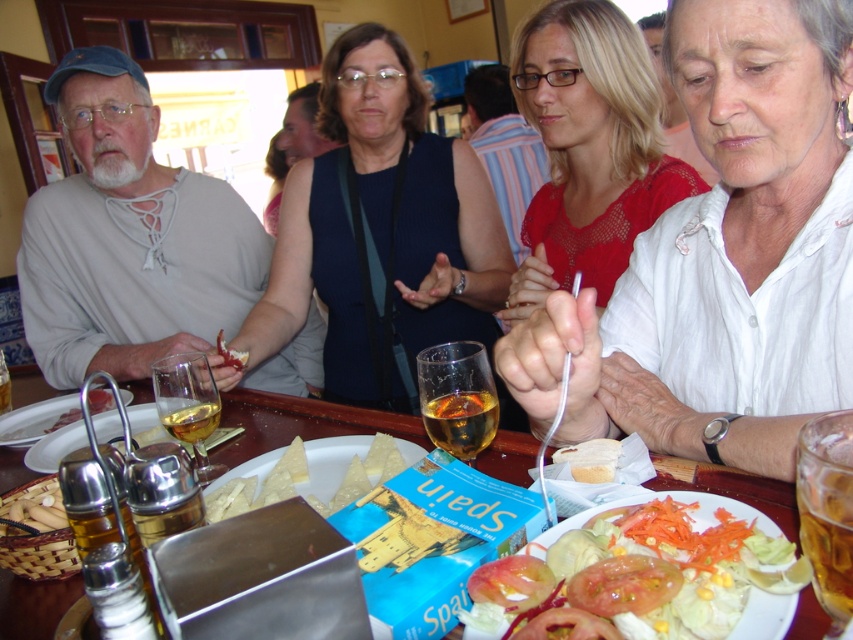
Question: Is yellow crumbly cheese at center bigger than smooth wooden sticks at lower left?

Choices:
 (A) yes
 (B) no

Answer: (A)

Question: Which point appears closest to the camera in this image?

Choices:
 (A) (189, 422)
 (B) (544, 547)
 (C) (840, 413)

Answer: (C)

Question: Which object is the farthest from the yellow crumbly cheese at center?

Choices:
 (A) white cotton shirt at upper right
 (B) smooth glass bottle at lower left
 (C) translucent glass wine at center

Answer: (B)

Question: Does wooden table at center appear on the left side of matte glass plate at center?

Choices:
 (A) yes
 (B) no

Answer: (B)

Question: Which is nearer to the blue knitted sweater at center?

Choices:
 (A) red lace dress at center
 (B) translucent glass wine glass at lower left
 (C) matte yellow cheese at center

Answer: (A)

Question: Observing the image, what is the correct spatial positioning of red lace dress at center in reference to fresh tomato salad at lower right?

Choices:
 (A) above
 (B) below

Answer: (A)